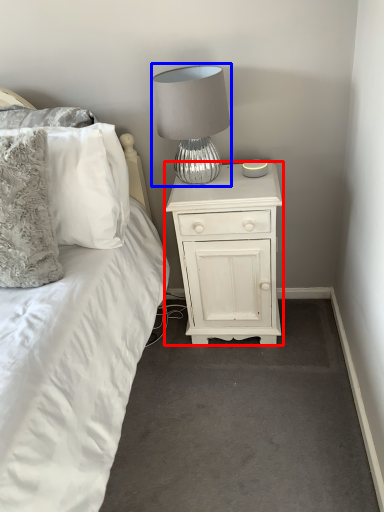
Question: Which point is further to the camera, nightstand (highlighted by a red box) or lamp (highlighted by a blue box)?

Choices:
 (A) nightstand
 (B) lamp

Answer: (A)